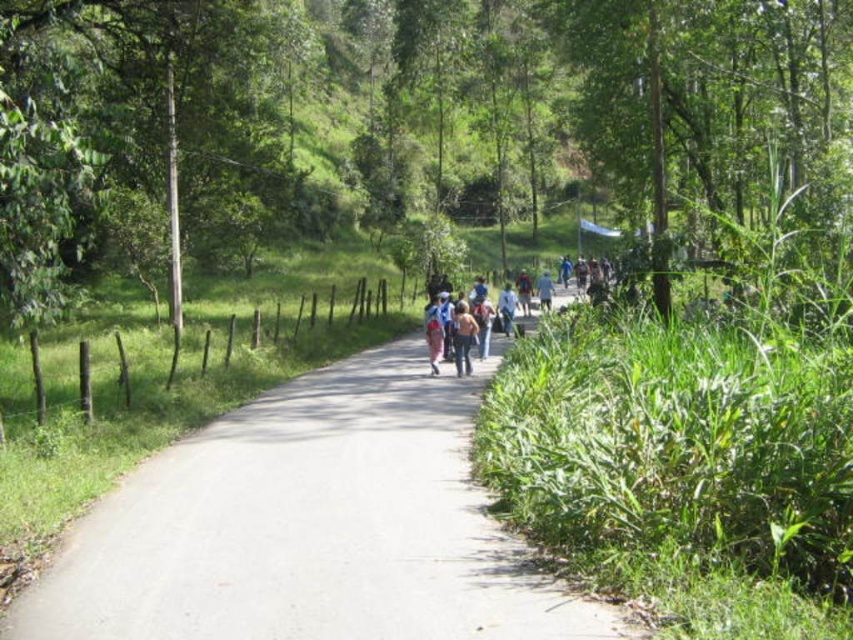
You are standing at the starting point of the path in this rural scene. The wooden fence is on your left. If you walk straight ahead along the path, which direction will the gray asphalt road at center take you?

The gray asphalt road at center leads towards the area where it merges with a larger populated area, as described in the scene.

You are a delivery person carrying a package in a denim jacket at center. You need to cross the gray asphalt road at center to deliver it. Is the road long enough for you to cross safely?

The gray asphalt road at center is shorter than the denim jacket at center. Since the road is shorter than the jacket, it might not be long enough for safe crossing. Please check the road length before proceeding.

You are a hiker who wants to place your matte blue backpack at center on the gray asphalt road at center. Based on their sizes, will the backpack fit entirely on the road?

The gray asphalt road at center is smaller than the matte blue backpack at center, so the backpack will not fit entirely on the road.